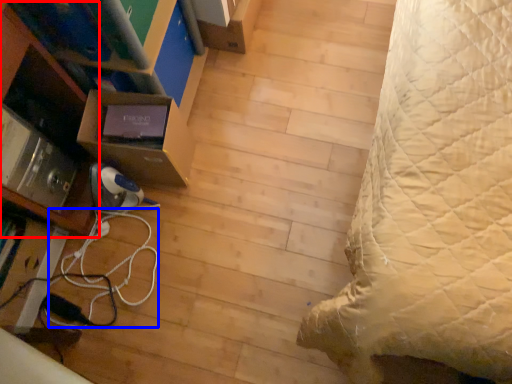
Question: Among these objects, which one is nearest to the camera, shelf (highlighted by a red box) or cable (highlighted by a blue box)?

Choices:
 (A) shelf
 (B) cable

Answer: (A)